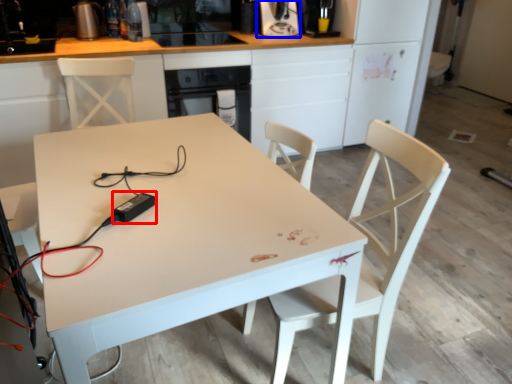
Question: Among these objects, which one is farthest to the camera, appliance (highlighted by a red box) or coffee machine (highlighted by a blue box)?

Choices:
 (A) appliance
 (B) coffee machine

Answer: (B)